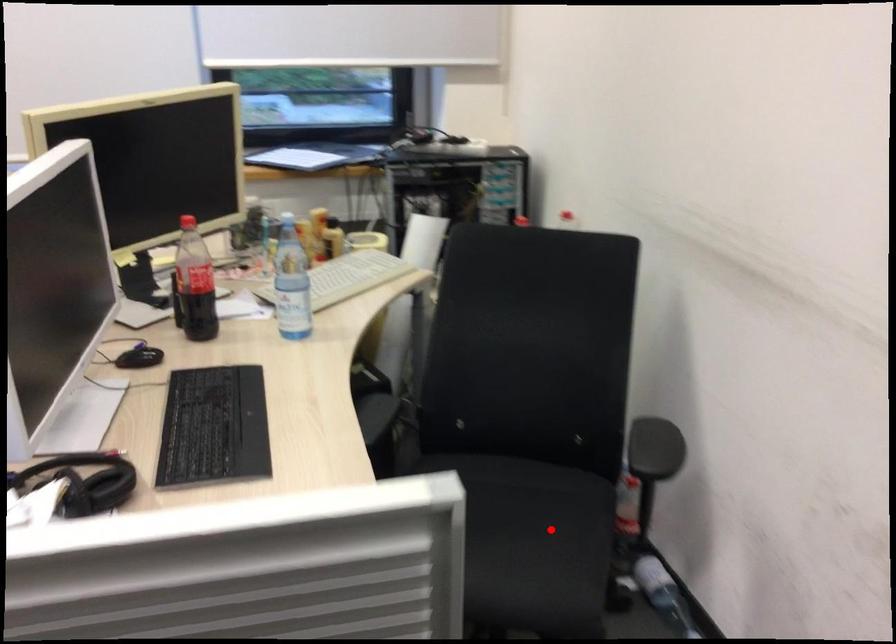
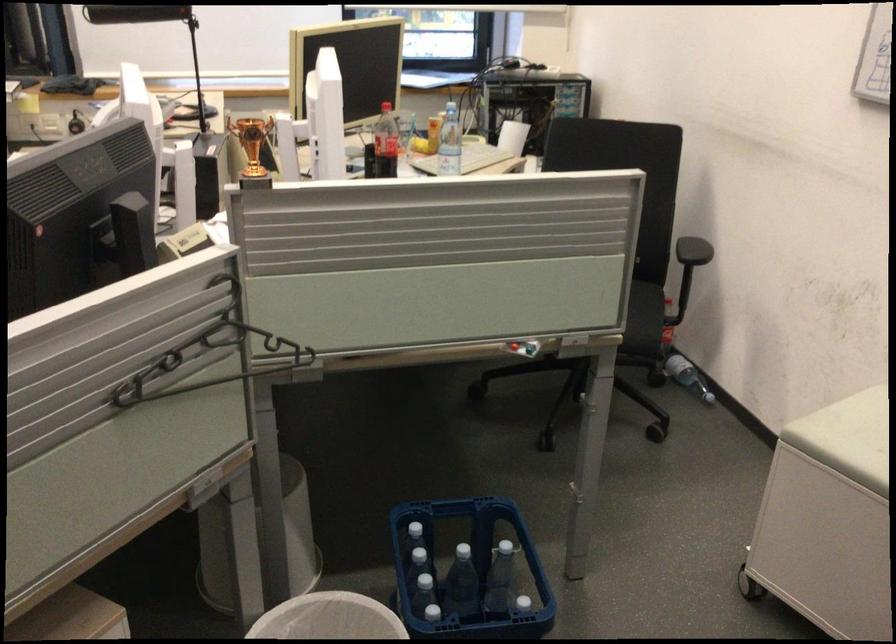
Question: I am providing you with two images of the same scene from different viewpoints. A red point is marked on the first image. At the location where the point appears in image 1, is it still visible in image 2?

Choices:
 (A) Yes
 (B) No

Answer: (B)